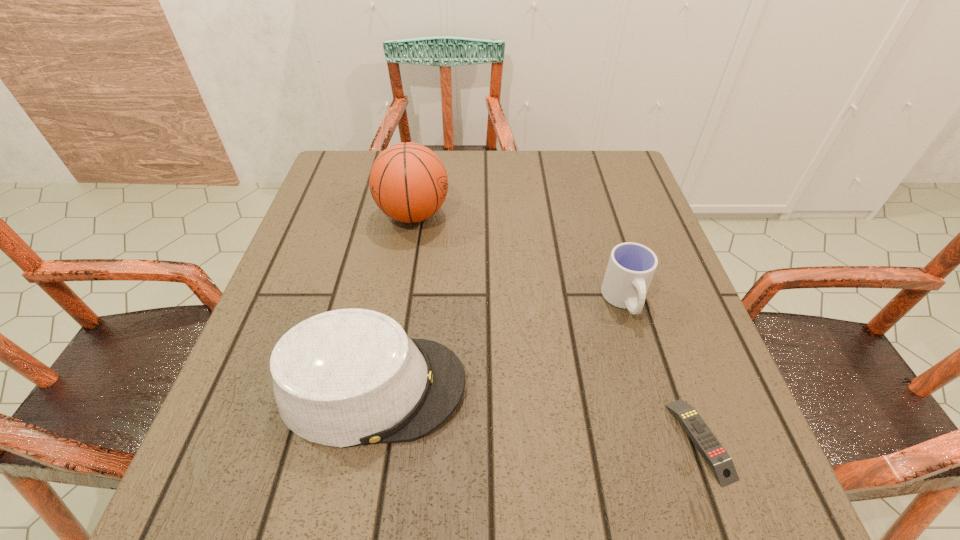
Where is `the farthest object`? This screenshot has width=960, height=540. the farthest object is located at coordinates (408, 182).

I want to click on basketball, so click(408, 182).

At what (x,y) coordinates should I click in order to perform the action: click on hat. Please return your answer as a coordinate pair (x, y). Looking at the image, I should click on point(347,377).

The image size is (960, 540). What are the coordinates of `cup` in the screenshot? It's located at (631, 266).

Locate an element on the screen. The height and width of the screenshot is (540, 960). the shortest object is located at coordinates (720, 462).

Image resolution: width=960 pixels, height=540 pixels. I want to click on free spot located on the front of the farthest object, so click(x=385, y=383).

What are the coordinates of `vacant space located 0.150m on the front-facing side of the hat` in the screenshot? It's located at (556, 387).

Image resolution: width=960 pixels, height=540 pixels. In order to click on vacant point located with the handle on the side of the cup in this screenshot , I will do `click(662, 427)`.

This screenshot has height=540, width=960. I want to click on vacant area situated 0.210m on the back of the shortest object, so click(x=651, y=302).

I want to click on object that is at the far edge, so [x=408, y=182].